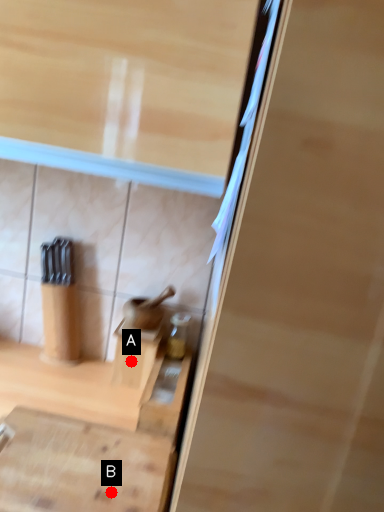
Question: Two points are circled on the image, labeled by A and B beside each circle. Which of the following is the closest to the observer?

Choices:
 (A) A is closer
 (B) B is closer

Answer: (B)